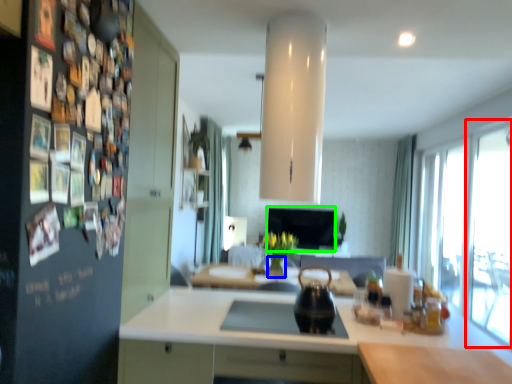
Question: Which object is positioned farthest from glass door (highlighted by a red box)? Select from vase (highlighted by a blue box) and window screen (highlighted by a green box).

Choices:
 (A) vase
 (B) window screen

Answer: (B)